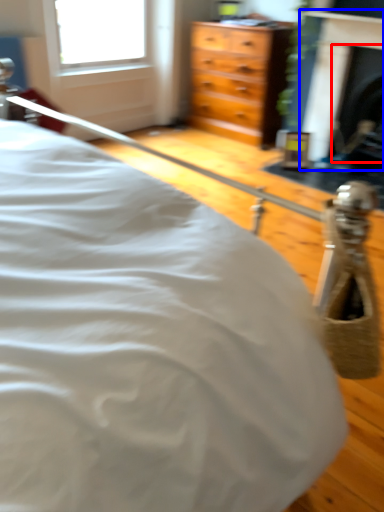
Question: Among these objects, which one is farthest to the camera, fireplace (highlighted by a red box) or fireplace (highlighted by a blue box)?

Choices:
 (A) fireplace
 (B) fireplace

Answer: (A)